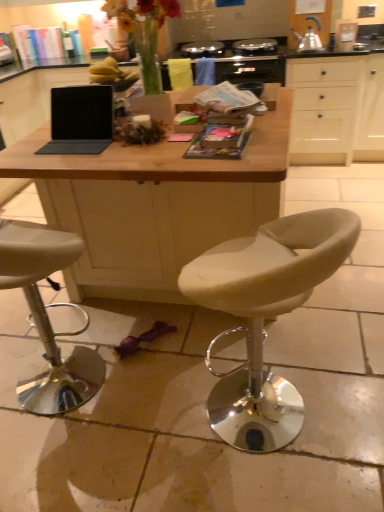
Find the location of a particular element. free spot below white leather stool at center, the 1th chair positioned from the right (from a real-world perspective) is located at coordinates (256, 433).